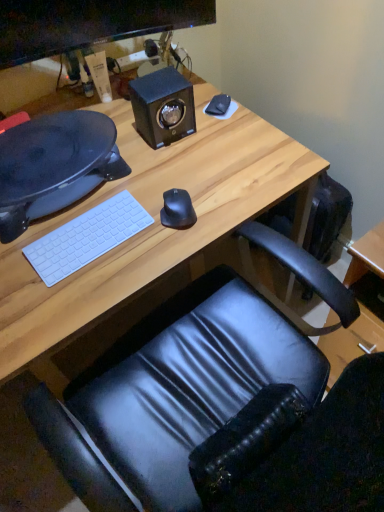
This screenshot has height=512, width=384. I want to click on free location to the right of black glossy speaker at left, so click(x=183, y=168).